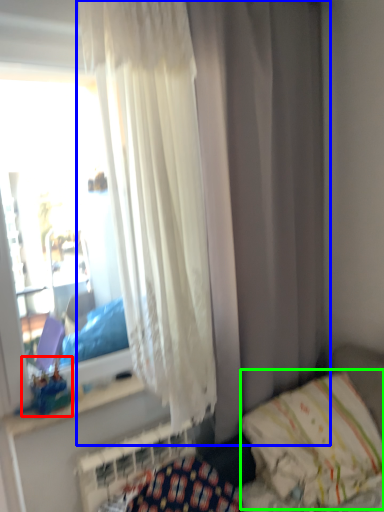
Question: Estimate the real-world distances between objects in this image. Which object is farther from toy (highlighted by a red box), curtain (highlighted by a blue box) or pillow (highlighted by a green box)?

Choices:
 (A) curtain
 (B) pillow

Answer: (A)